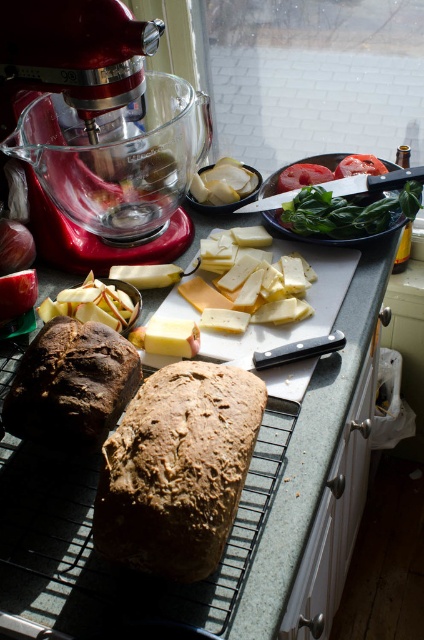
Does point (103, 353) lie in front of point (315, 163)?

Yes.

Does dark brown crusty loaf of bread at lower left have a smaller size compared to metallic silver platter at center?

Correct, dark brown crusty loaf of bread at lower left occupies less space than metallic silver platter at center.

I want to click on dark brown crusty loaf of bread at lower left, so click(72, 385).

Is dark brown crusty loaf of bread at lower left above translucent plastic bag at center?

Actually, dark brown crusty loaf of bread at lower left is below translucent plastic bag at center.

Is dark brown crusty loaf of bread at lower left positioned behind translucent plastic bag at center?

That is False.

Does point (49, 381) come farther from viewer compared to point (225, 193)?

No, it is not.

Where is `dark brown crusty loaf of bread at lower left`? This screenshot has width=424, height=640. dark brown crusty loaf of bread at lower left is located at coordinates (72, 385).

Who is positioned more to the right, red metallic stand mixer at upper left or dark brown crusty loaf of bread at lower left?

red metallic stand mixer at upper left is more to the right.

Can you confirm if red metallic stand mixer at upper left is bigger than dark brown crusty loaf of bread at lower left?

Correct, red metallic stand mixer at upper left is larger in size than dark brown crusty loaf of bread at lower left.

This screenshot has height=640, width=424. I want to click on red metallic stand mixer at upper left, so click(x=100, y=132).

Where is `red metallic stand mixer at upper left`? The height and width of the screenshot is (640, 424). red metallic stand mixer at upper left is located at coordinates (100, 132).